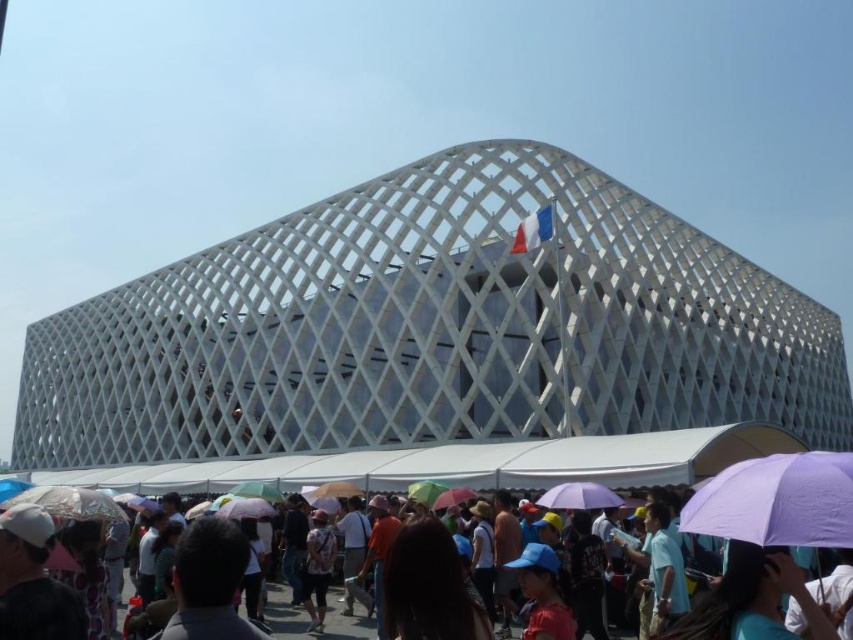
Question: Does green matte umbrella at lower center appear on the left side of rainbow fabric umbrella at center?

Choices:
 (A) yes
 (B) no

Answer: (A)

Question: Does white fabric umbrella at lower center have a greater width compared to green matte umbrella at lower center?

Choices:
 (A) no
 (B) yes

Answer: (B)

Question: Which object is the closest to the white matte umbrella at center?

Choices:
 (A) white matte umbrella at lower left
 (B) transparent plastic umbrella at lower left
 (C) purple matte umbrella at lower right
 (D) pink fabric umbrella at center

Answer: (D)

Question: Considering the real-world distances, which object is closest to the purple matte umbrella at center?

Choices:
 (A) purple matte umbrella at lower right
 (B) transparent plastic umbrella at lower left
 (C) multicolored fabric umbrella at center

Answer: (C)

Question: Does transparent plastic umbrella at lower left have a larger size compared to white matte umbrella at center?

Choices:
 (A) yes
 (B) no

Answer: (A)

Question: Among these objects, which one is nearest to the camera?

Choices:
 (A) white matte umbrella at lower left
 (B) rainbow fabric umbrella at center
 (C) transparent plastic umbrella at lower left
 (D) pink fabric umbrella at center

Answer: (C)